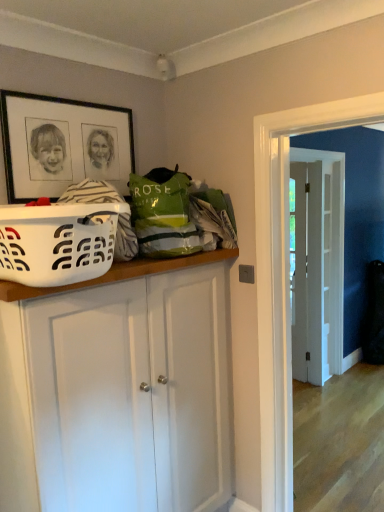
Question: Would you say black matte picture frame at upper left is to the left or to the right of white wooden door at center in the picture?

Choices:
 (A) left
 (B) right

Answer: (A)

Question: From the image's perspective, is black matte picture frame at upper left located above or below white wooden door at center?

Choices:
 (A) below
 (B) above

Answer: (B)

Question: Estimate the real-world distances between objects in this image. Which object is farther from the black matte picture frame at upper left?

Choices:
 (A) white matte cabinet at center
 (B) white plastic laundry basket at left
 (C) white wooden door at center

Answer: (C)

Question: Estimate the real-world distances between objects in this image. Which object is farther from the white matte cabinet at center?

Choices:
 (A) black matte picture frame at upper left
 (B) white wooden door at center
 (C) white plastic laundry basket at left

Answer: (B)